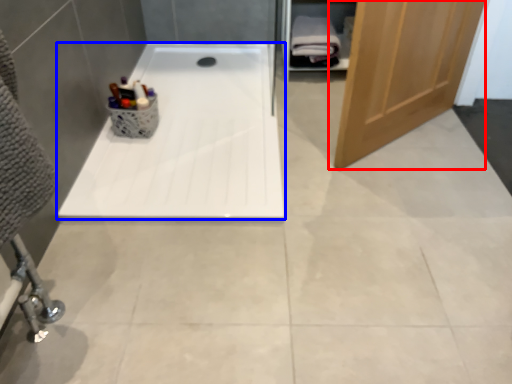
Question: Which point is closer to the camera, door (highlighted by a red box) or bathtub (highlighted by a blue box)?

Choices:
 (A) door
 (B) bathtub

Answer: (A)